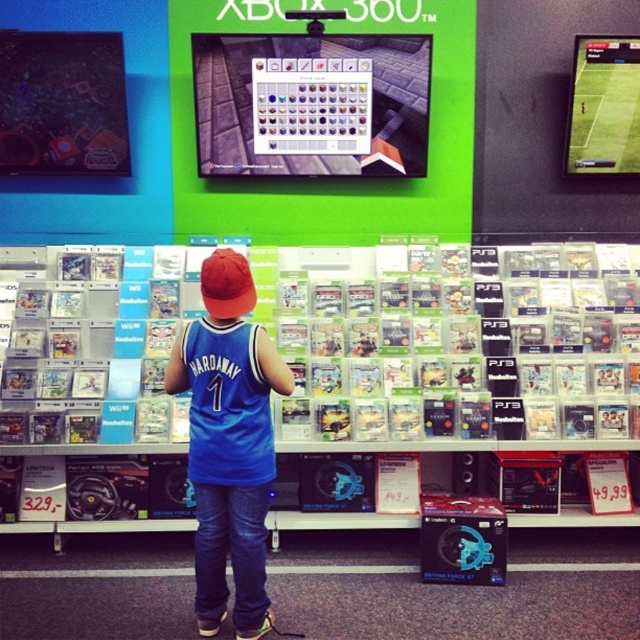
You are a customer in the store and want to know if the blue jersey at center is bigger than the green matte soccer game at upper center. Can you confirm?

The blue jersey at center has a larger size compared to the green matte soccer game at upper center, so yes, the blue jersey at center is bigger.

You are a store employee who needs to place a new poster that is 1.2 meters wide between the blue jersey at center and the green matte soccer game at upper center. Can the poster fit in the space between them?

The blue jersey at center is wider than the green matte soccer game at upper center, so the space between them may not accommodate a 1.2 meter wide poster. Measure the actual distance before deciding.

You are a delivery person who needs to place a large box between the blue jersey at center and the Xbox 360 display shelf. The box requires 3 meters of space. Is there enough space?

The distance between the blue jersey at center and the Xbox 360 display shelf is 2.74 meters, which is less than the required 3 meters. Therefore, there is not enough space to place the box.